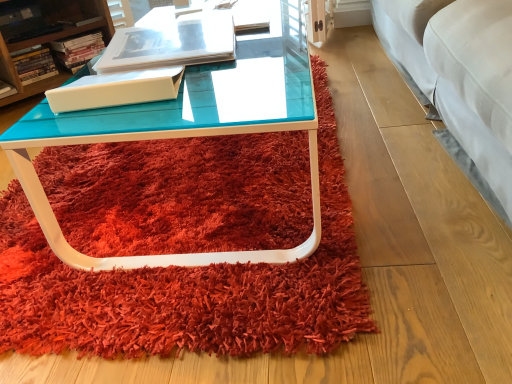
This screenshot has width=512, height=384. I want to click on teal glass coffee table at center, so click(188, 132).

Find the location of a particular element. The height and width of the screenshot is (384, 512). matte white book at upper left, which is the second book from back to front is located at coordinates (78, 49).

Where is `matte white book at upper left, the 3th book from the right`? The width and height of the screenshot is (512, 384). matte white book at upper left, the 3th book from the right is located at coordinates (79, 20).

Locate an element on the screen. The width and height of the screenshot is (512, 384). teal glass coffee table at center is located at coordinates (188, 132).

Is matte white book at center, the 1th book when ordered from left to right, facing towards white plastic container at upper left?

No, matte white book at center, the 1th book when ordered from left to right, is not turned towards white plastic container at upper left.

In the scene shown: Considering the relative positions of matte white book at center, the second book when ordered from front to back, and white plastic container at upper left in the image provided, is matte white book at center, the second book when ordered from front to back, in front of white plastic container at upper left?

No, the depth of matte white book at center, the second book when ordered from front to back, is greater than that of white plastic container at upper left.

From the image's perspective, which is above, matte white book at center, the 1th book when ordered from left to right, or white plastic container at upper left?

white plastic container at upper left, from the image's perspective.

From a real-world perspective, is hardcover book at upper left, which is counted as the third book, starting from the front, beneath white plastic container at upper left?

Yes, from a real-world perspective, hardcover book at upper left, which is counted as the third book, starting from the front, is beneath white plastic container at upper left.

From the image's perspective, is hardcover book at upper left, positioned as the third book in back-to-front order, located above or below white plastic container at upper left?

hardcover book at upper left, positioned as the third book in back-to-front order, is situated lower than white plastic container at upper left in the image.

Is point (28, 63) closer to viewer compared to point (67, 72)?

Yes, point (28, 63) is closer to viewer.

How many degrees apart are the facing directions of matte white book at upper left, the third book from the left, and teal glass coffee table at center?

35.5 degrees separate the facing orientations of matte white book at upper left, the third book from the left, and teal glass coffee table at center.

This screenshot has height=384, width=512. Find the location of `coffee table located in front of the matte white book at upper left, the fifth book positioned from the front`. coffee table located in front of the matte white book at upper left, the fifth book positioned from the front is located at coordinates (188, 132).

Is matte white book at upper left, the fifth book positioned from the front, positioned far away from teal glass coffee table at center?

Yes, matte white book at upper left, the fifth book positioned from the front, and teal glass coffee table at center are quite far apart.

Choose the correct answer: Is matte white book at upper left, the fifth book positioned from the front, inside white plastic container at upper left or outside it?

matte white book at upper left, the fifth book positioned from the front, is located inside white plastic container at upper left.

From a real-world perspective, is matte white book at upper left, acting as the first book starting from the back, located higher than white plastic container at upper left?

Yes, from a real-world perspective, matte white book at upper left, acting as the first book starting from the back, is on top of white plastic container at upper left.

Is matte white book at upper left, the fifth book positioned from the front, oriented away from white plastic container at upper left?

That's right, matte white book at upper left, the fifth book positioned from the front, is facing away from white plastic container at upper left.

Is the position of matte white book at upper left, the 3th book from the right, more distant than that of white plastic container at upper left?

Yes, the depth of matte white book at upper left, the 3th book from the right, is greater than that of white plastic container at upper left.

Is point (98, 20) in front of point (182, 25)?

No, (98, 20) is behind (182, 25).

Can we say matte white book at upper left, the fifth book positioned from the front, lies outside white glossy book at upper center, the 1th book positioned from the right?

Absolutely, matte white book at upper left, the fifth book positioned from the front, is external to white glossy book at upper center, the 1th book positioned from the right.

Is the position of matte white book at upper left, the 3th book from the right, less distant than that of white glossy book at upper center, marked as the fifth book in a left-to-right arrangement?

No, matte white book at upper left, the 3th book from the right, is behind white glossy book at upper center, marked as the fifth book in a left-to-right arrangement.

From the picture: Can you tell me how much matte white book at upper left, the 3th book from the right, and white glossy book at upper center, the first book from the front, differ in facing direction?

There is a 46.7-degree angle between the facing directions of matte white book at upper left, the 3th book from the right, and white glossy book at upper center, the first book from the front.

Is white glossy book at upper center, the first book from the front, inside the boundaries of white plastic container at upper left, or outside?

white glossy book at upper center, the first book from the front, is not inside white plastic container at upper left, it's outside.

Could you tell me if white glossy book at upper center, which is the 5th book from back to front, is turned towards white plastic container at upper left?

No, white glossy book at upper center, which is the 5th book from back to front, does not turn towards white plastic container at upper left.

In terms of height, does white glossy book at upper center, which is the 5th book from back to front, look taller or shorter compared to white plastic container at upper left?

In the image, white glossy book at upper center, which is the 5th book from back to front, appears to be shorter than white plastic container at upper left.

Is point (214, 39) positioned behind point (89, 30)?

No, it is not.

There is a matte white book at upper left, the fourth book positioned from the left. At what (x,y) coordinates should I click in order to perform the action: click on the 1st book above it (from a real-world perspective). Please return your answer as a coordinate pair (x, y). This screenshot has width=512, height=384. Looking at the image, I should click on (79, 20).

From a real-world perspective, is matte white book at upper left, the fifth book positioned from the front, positioned over matte white book at upper left, which is the second book from back to front, based on gravity?

Indeed, from a real-world perspective, matte white book at upper left, the fifth book positioned from the front, stands above matte white book at upper left, which is the second book from back to front.

Consider the image. Is matte white book at upper left, the third book from the left, completely or partially outside of matte white book at upper left, the fourth book viewed from the front?

Yes, matte white book at upper left, the third book from the left, is outside of matte white book at upper left, the fourth book viewed from the front.

Which is less distant, (61, 22) or (79, 51)?

Point (61, 22)

This screenshot has height=384, width=512. I want to click on the 3rd book positioned below the white plastic container at upper left (from the image's perspective), so click(x=6, y=90).

This screenshot has width=512, height=384. Find the location of `cabinetry in front of the hardcover book at upper left, placed as the second book when sorted from left to right`. cabinetry in front of the hardcover book at upper left, placed as the second book when sorted from left to right is located at coordinates tap(50, 38).

Based on their spatial positions, is white glossy book at upper center, which is the 5th book from back to front, or white plastic container at upper left further from teal glass coffee table at center?

Among the two, white plastic container at upper left is located further to teal glass coffee table at center.

Considering their positions, is matte white book at center, the 1th book when ordered from left to right, positioned closer to matte white book at upper left, the third book from the left, than matte white book at upper left, the second book when ordered from right to left?

matte white book at upper left, the second book when ordered from right to left, is closer to matte white book at upper left, the third book from the left.

Estimate the real-world distances between objects in this image. Which object is further from white glossy book at upper center, marked as the fifth book in a left-to-right arrangement, matte white book at center, which is counted as the 5th book, starting from the right, or matte white book at upper left, the third book from the left?

matte white book at upper left, the third book from the left, is further to white glossy book at upper center, marked as the fifth book in a left-to-right arrangement.

Consider the image. From the image, which object appears to be farther from matte white book at center, the 1th book when ordered from left to right, matte white book at upper left, the fourth book viewed from the front, or hardcover book at upper left, placed as the second book when sorted from left to right?

matte white book at upper left, the fourth book viewed from the front, is positioned further to the anchor matte white book at center, the 1th book when ordered from left to right.

Which object lies nearer to the anchor point matte white book at center, the second book when ordered from front to back, white glossy book at upper center, marked as the fifth book in a left-to-right arrangement, or matte white book at upper left, the fifth book positioned from the front?

matte white book at upper left, the fifth book positioned from the front.

Looking at the image, which one is located further to matte white book at upper left, the third book from the left, matte white book at upper left, the fourth book viewed from the front, or matte white book at center, the 1th book when ordered from left to right?

The object further to matte white book at upper left, the third book from the left, is matte white book at center, the 1th book when ordered from left to right.

Which object lies further to the anchor point teal glass coffee table at center, white glossy book at upper center, marked as the fifth book in a left-to-right arrangement, or matte white book at upper left, which is the second book from back to front?

The object further to teal glass coffee table at center is matte white book at upper left, which is the second book from back to front.

Which object lies further to the anchor point matte white book at upper left, the second book when ordered from right to left, teal glass coffee table at center or matte white book at center, arranged as the 4th book when viewed from the back?

teal glass coffee table at center is positioned further to the anchor matte white book at upper left, the second book when ordered from right to left.

At what (x,y) coordinates should I click in order to perform the action: click on cabinetry between white glossy book at upper center, the 1th book positioned from the right, and matte white book at upper left, the second book when ordered from right to left, along the z-axis. Please return your answer as a coordinate pair (x, y). Looking at the image, I should click on (50, 38).

Where is `cabinetry between matte white book at center, the 1th book when ordered from left to right, and matte white book at upper left, the 3th book from the right, in the horizontal direction`? This screenshot has height=384, width=512. cabinetry between matte white book at center, the 1th book when ordered from left to right, and matte white book at upper left, the 3th book from the right, in the horizontal direction is located at coordinates pyautogui.click(x=50, y=38).

What are the coordinates of `cabinetry between matte white book at center, which is counted as the 5th book, starting from the right, and matte white book at upper left, the fourth book positioned from the left, from left to right` in the screenshot? It's located at (50, 38).

Identify the location of book between matte white book at center, arranged as the 4th book when viewed from the back, and matte white book at upper left, acting as the first book starting from the back, in the horizontal direction. (34, 65).